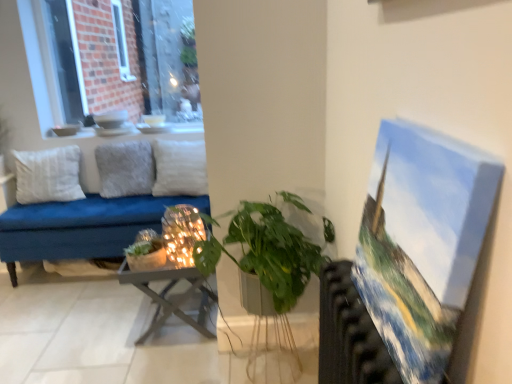
Question: Are brick wall at upper left and oil paint canvas at right making contact?

Choices:
 (A) yes
 (B) no

Answer: (B)

Question: Is brick wall at upper left closer to camera compared to oil paint canvas at right?

Choices:
 (A) no
 (B) yes

Answer: (A)

Question: Does brick wall at upper left have a greater height compared to oil paint canvas at right?

Choices:
 (A) no
 (B) yes

Answer: (B)

Question: Can you confirm if brick wall at upper left is positioned to the left of oil paint canvas at right?

Choices:
 (A) no
 (B) yes

Answer: (B)

Question: Is brick wall at upper left turned away from oil paint canvas at right?

Choices:
 (A) yes
 (B) no

Answer: (B)

Question: Looking at their shapes, would you say oil paint canvas at right is wider or thinner than metallic radiator at right?

Choices:
 (A) wide
 (B) thin

Answer: (B)

Question: Relative to metallic radiator at right, is oil paint canvas at right in front or behind?

Choices:
 (A) behind
 (B) front

Answer: (B)

Question: Is oil paint canvas at right inside or outside of metallic radiator at right?

Choices:
 (A) inside
 (B) outside

Answer: (B)

Question: From a real-world perspective, relative to metallic radiator at right, is oil paint canvas at right vertically above or below?

Choices:
 (A) above
 (B) below

Answer: (A)

Question: From a real-world perspective, is iridescent glass candle holder at center physically located above or below white cotton pillow at left, which appears as the 1th pillow when viewed from the left?

Choices:
 (A) above
 (B) below

Answer: (B)

Question: Considering the positions of point (180, 223) and point (25, 183), is point (180, 223) closer or farther from the camera than point (25, 183)?

Choices:
 (A) farther
 (B) closer

Answer: (B)

Question: Is iridescent glass candle holder at center taller or shorter than white cotton pillow at left, acting as the 3th pillow starting from the right?

Choices:
 (A) tall
 (B) short

Answer: (B)

Question: Is iridescent glass candle holder at center wider or thinner than white cotton pillow at left, acting as the 3th pillow starting from the right?

Choices:
 (A) thin
 (B) wide

Answer: (A)

Question: From the image's perspective, is white ceramic vase at upper center located above or below metallic radiator at right?

Choices:
 (A) below
 (B) above

Answer: (B)

Question: Does point (198, 127) appear closer or farther from the camera than point (388, 360)?

Choices:
 (A) closer
 (B) farther

Answer: (B)